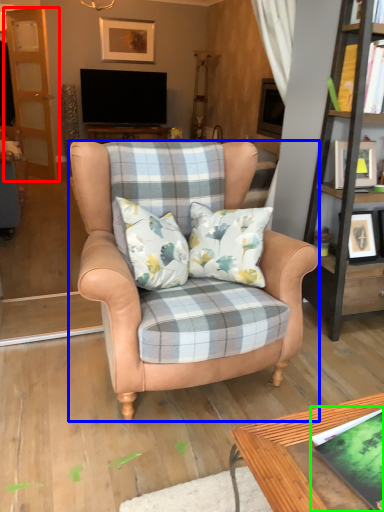
Question: Estimate the real-world distances between objects in this image. Which object is farther from screen door (highlighted by a red box), chair (highlighted by a blue box) or book (highlighted by a green box)?

Choices:
 (A) chair
 (B) book

Answer: (B)